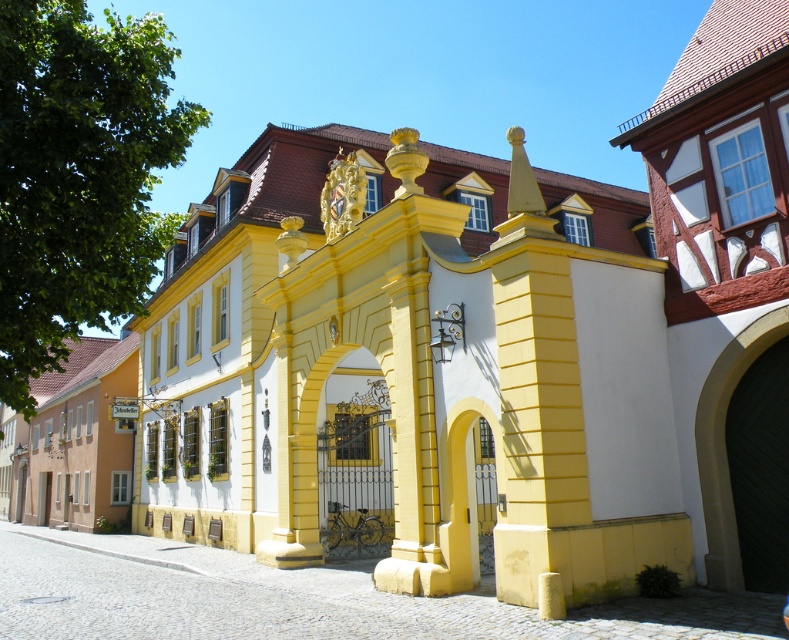
Is beige stone archway at center wider than yellow matte gate at center?

Yes, beige stone archway at center is wider than yellow matte gate at center.

Between beige stone archway at center and yellow matte gate at center, which one is positioned higher?

beige stone archway at center is higher up.

Is point (703, 499) more distant than point (490, 436)?

No.

Where is `beige stone archway at center`? beige stone archway at center is located at coordinates coord(724,444).